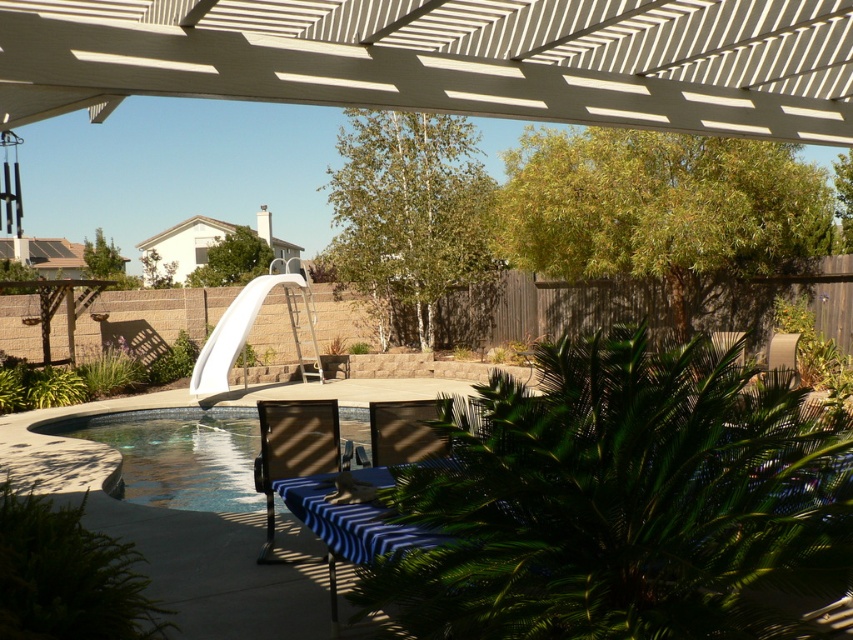
Question: Does white plastic slide at upper center appear on the left side of matte black chair at center?

Choices:
 (A) no
 (B) yes

Answer: (B)

Question: Can you confirm if blue tile swimming pool at lower left is wider than matte black chair at center?

Choices:
 (A) yes
 (B) no

Answer: (B)

Question: Which of these objects is positioned farthest from the matte black chair at center?

Choices:
 (A) white plastic slide at upper center
 (B) blue tile swimming pool at lower left

Answer: (A)

Question: Which point is closer to the camera taking this photo?

Choices:
 (A) (251, 282)
 (B) (184, 500)
 (C) (376, 413)
 (D) (286, 458)

Answer: (D)

Question: Which point appears closest to the camera in this image?

Choices:
 (A) (164, 432)
 (B) (416, 426)

Answer: (B)

Question: Can you confirm if blue tile swimming pool at lower left is positioned to the left of matte black chair at center?

Choices:
 (A) no
 (B) yes

Answer: (B)